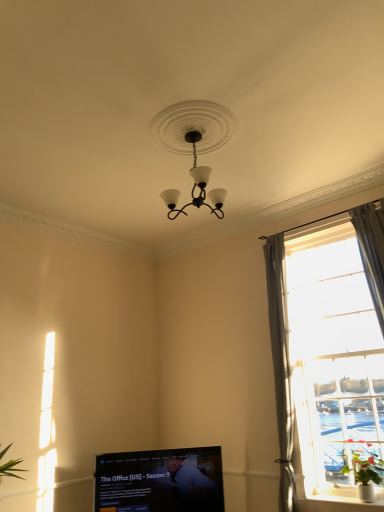
Question: Are matte black television at lower center and matte black chandelier at center located far from each other?

Choices:
 (A) yes
 (B) no

Answer: (A)

Question: Can you confirm if matte black television at lower center is smaller than matte black chandelier at center?

Choices:
 (A) yes
 (B) no

Answer: (B)

Question: Is matte black television at lower center thinner than matte black chandelier at center?

Choices:
 (A) yes
 (B) no

Answer: (A)

Question: Does matte black television at lower center have a lesser height compared to matte black chandelier at center?

Choices:
 (A) yes
 (B) no

Answer: (A)

Question: Can you confirm if matte black television at lower center is taller than matte black chandelier at center?

Choices:
 (A) no
 (B) yes

Answer: (A)

Question: In the image, is matte black television at lower center positioned in front of or behind green leafy plant at right?

Choices:
 (A) front
 (B) behind

Answer: (B)

Question: Considering the positions of matte black television at lower center and green leafy plant at right in the image, is matte black television at lower center bigger or smaller than green leafy plant at right?

Choices:
 (A) big
 (B) small

Answer: (A)

Question: From their relative heights in the image, would you say matte black television at lower center is taller or shorter than green leafy plant at right?

Choices:
 (A) short
 (B) tall

Answer: (B)

Question: Do you think matte black television at lower center is within green leafy plant at right, or outside of it?

Choices:
 (A) outside
 (B) inside

Answer: (A)

Question: Visually, is green leafy plant at right positioned to the left or to the right of clear glass window at right?

Choices:
 (A) left
 (B) right

Answer: (A)

Question: Considering their positions, is green leafy plant at right located in front of or behind clear glass window at right?

Choices:
 (A) behind
 (B) front

Answer: (B)

Question: Looking at their shapes, would you say green leafy plant at right is wider or thinner than clear glass window at right?

Choices:
 (A) thin
 (B) wide

Answer: (B)

Question: Is green leafy plant at right bigger or smaller than clear glass window at right?

Choices:
 (A) big
 (B) small

Answer: (B)

Question: Is green leafy plant at right spatially inside matte black television at lower center, or outside of it?

Choices:
 (A) inside
 (B) outside

Answer: (B)

Question: Is point pyautogui.click(x=374, y=472) positioned closer to the camera than point pyautogui.click(x=220, y=460)?

Choices:
 (A) closer
 (B) farther

Answer: (A)